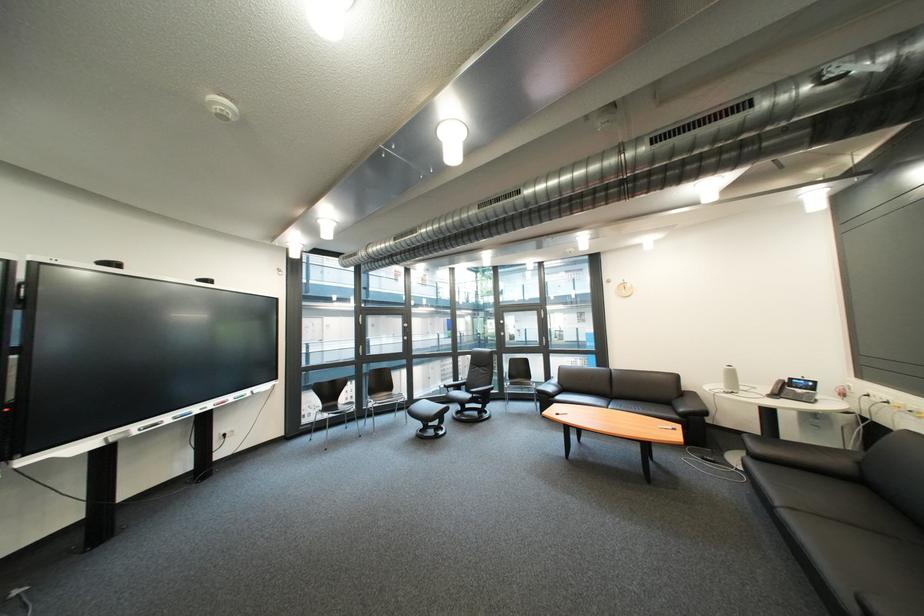
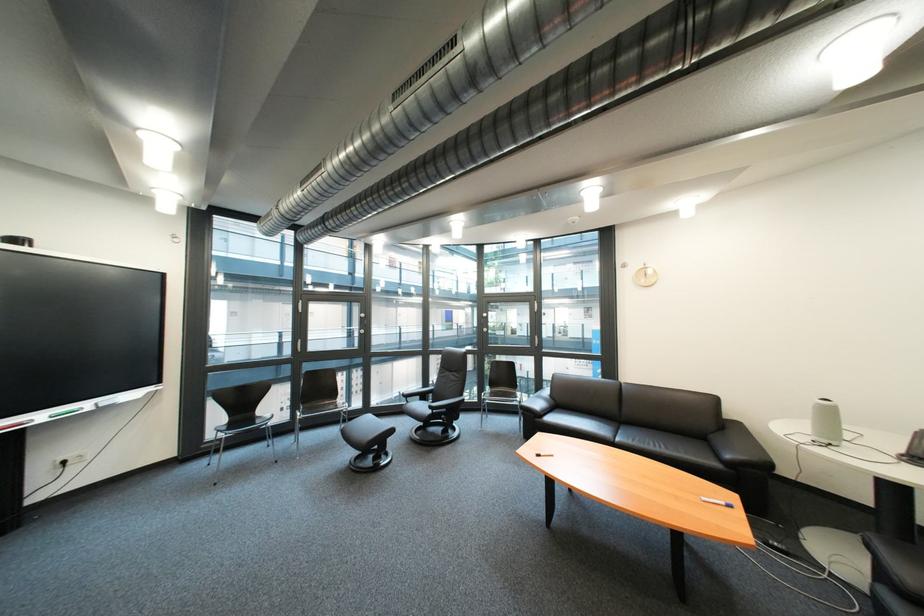
Locate, in the second image, the point that corresponds to point (463, 391) in the first image.

(421, 400)